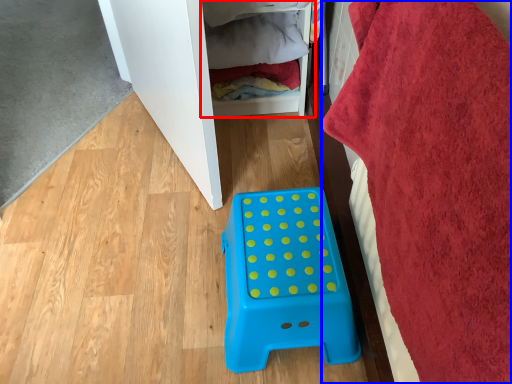
Question: Which object appears farthest to the camera in this image, shelf (highlighted by a red box) or bath towel (highlighted by a blue box)?

Choices:
 (A) shelf
 (B) bath towel

Answer: (A)